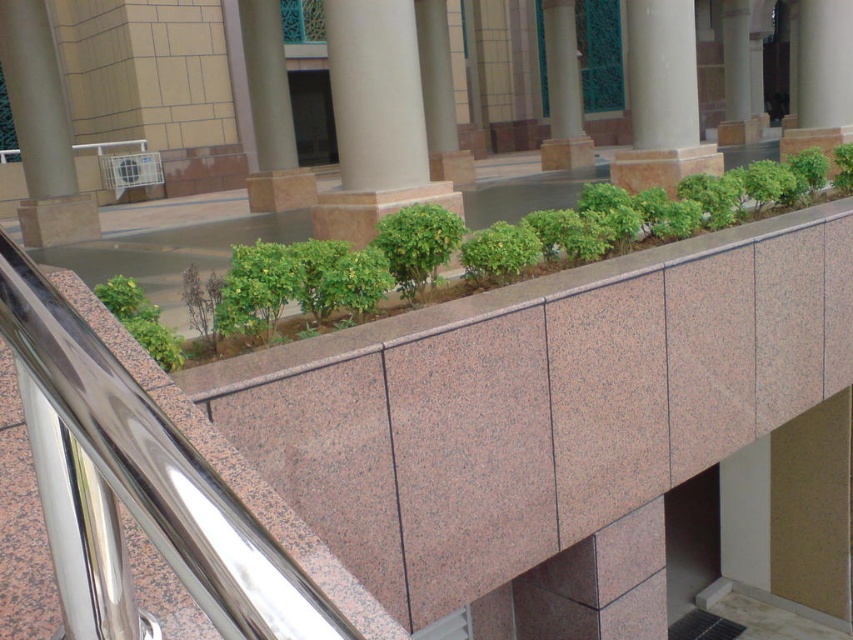
You are a visitor standing in front of the beige polished stone pillar at center and the pink granite pillar at center. Which pillar is closer to you?

The beige polished stone pillar at center is closer to you since it is positioned in front of the pink granite pillar at center.

From the picture: You are standing in front of the architectural structure and want to take a photo of both the beige polished stone pillar at center and the beige polished stone pillar at upper left. Which pillar should you position yourself closer to in order to capture both pillars in the frame without moving your camera?

You should position yourself closer to the beige polished stone pillar at center because the beige polished stone pillar at upper left is behind it, so moving closer to the pillar in front allows both to be in the frame without obstruction.

In the scene shown: You are an architect designing a new plaza and want to place a 1.2 meter wide statue between the beige polished stone pillar at center and the pink granite pillar at center. Can the space between them accommodate this statue?

The beige polished stone pillar at center has a smaller size compared to pink granite pillar at center. However, the exact distance between them isn not specified in the provided information. Without knowing the actual spacing between the pillars, it is impossible to determine if the 1.2 meter wide statue will fit.